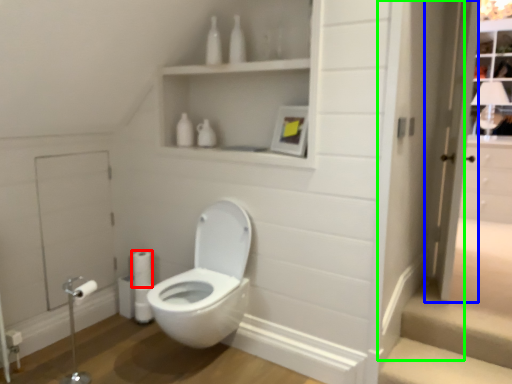
Question: Which object is the farthest from toilet paper (highlighted by a red box)? Choose among these: screen door (highlighted by a blue box) or door (highlighted by a green box).

Choices:
 (A) screen door
 (B) door

Answer: (A)